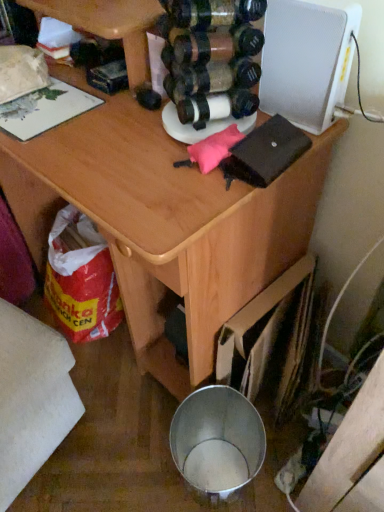
What do you see at coordinates (306, 61) in the screenshot?
I see `white textured speaker at upper right` at bounding box center [306, 61].

In order to face white textured speaker at upper right, should I rotate leftwards or rightwards?

To face it directly, rotate right by 14.297 degrees.

You are a GUI agent. You are given a task and a screenshot of the screen. Output one action in this format:
    pyautogui.click(x=<x>, y=<y>)
    Task: Click on the white textured speaker at upper right
    The width and height of the screenshot is (384, 512).
    Given the screenshot: What is the action you would take?
    click(306, 61)

Locate an element on the screen. wooden desk at center is located at coordinates (166, 223).

Describe the element at coordinates (166, 223) in the screenshot. I see `wooden desk at center` at that location.

Identify the location of white textured speaker at upper right. (306, 61).

Which is more to the left, white textured speaker at upper right or wooden desk at center?

From the viewer's perspective, wooden desk at center appears more on the left side.

In the scene shown: Is white textured speaker at upper right positioned in front of wooden desk at center?

No.

Which is in front, point (322, 71) or point (120, 101)?

The point (322, 71) is closer.

From the image's perspective, would you say white textured speaker at upper right is shown under wooden desk at center?

No.

From a real-world perspective, relative to wooden desk at center, is white textured speaker at upper right vertically above or below?

In terms of real-world spatial position, white textured speaker at upper right is above wooden desk at center.

Looking at their sizes, would you say white textured speaker at upper right is wider or thinner than wooden desk at center?

white textured speaker at upper right is thinner than wooden desk at center.

Who is shorter, white textured speaker at upper right or wooden desk at center?

Standing shorter between the two is white textured speaker at upper right.

Considering the relative sizes of white textured speaker at upper right and wooden desk at center in the image provided, is white textured speaker at upper right bigger than wooden desk at center?

No.

From the picture: Is white textured speaker at upper right located outside wooden desk at center?

No, most part of white textured speaker at upper right lies within wooden desk at center.

Are white textured speaker at upper right and wooden desk at center located far from each other?

No, there isn't a large distance between white textured speaker at upper right and wooden desk at center.

Based on the photo, does white textured speaker at upper right turn towards wooden desk at center?

Yes, white textured speaker at upper right is oriented towards wooden desk at center.

Image resolution: width=384 pixels, height=512 pixels. What are the coordinates of `appliance lying on the right of wooden desk at center` in the screenshot? It's located at (306, 61).

Visually, is wooden desk at center positioned to the left or to the right of white textured speaker at upper right?

Clearly, wooden desk at center is on the left of white textured speaker at upper right in the image.

Considering the positions of objects wooden desk at center and white textured speaker at upper right in the image provided, who is in front, wooden desk at center or white textured speaker at upper right?

wooden desk at center is in front.

Does point (293, 180) appear closer or farther from the camera than point (296, 60)?

Clearly, point (293, 180) is more distant from the camera than point (296, 60).

In the scene shown: From the image's perspective, between wooden desk at center and white textured speaker at upper right, which one is located above?

white textured speaker at upper right appears higher in the image.

From a real-world perspective, which is physically below, wooden desk at center or white textured speaker at upper right?

wooden desk at center is physically lower.

Which object is thinner, wooden desk at center or white textured speaker at upper right?

Thinner between the two is white textured speaker at upper right.

Is wooden desk at center shorter than white textured speaker at upper right?

Incorrect, the height of wooden desk at center does not fall short of that of white textured speaker at upper right.

Considering the sizes of objects wooden desk at center and white textured speaker at upper right in the image provided, who is bigger, wooden desk at center or white textured speaker at upper right?

wooden desk at center is bigger.

Can white textured speaker at upper right be found inside wooden desk at center?

Yes, white textured speaker at upper right is inside wooden desk at center.

Is wooden desk at center directly adjacent to white textured speaker at upper right?

They are not placed beside each other.

Is wooden desk at center turned away from white textured speaker at upper right?

Yes.

Based on the photo, what's the angular difference between wooden desk at center and white textured speaker at upper right's facing directions?

The angle between the facing direction of wooden desk at center and the facing direction of white textured speaker at upper right is 3.65 degrees.

Locate an element on the screen. desk on the left of the white textured speaker at upper right is located at coordinates (166, 223).

Find the location of a particular element. appliance on the right side of wooden desk at center is located at coordinates (306, 61).

Find the location of `desk in front of the white textured speaker at upper right`. desk in front of the white textured speaker at upper right is located at coordinates (166, 223).